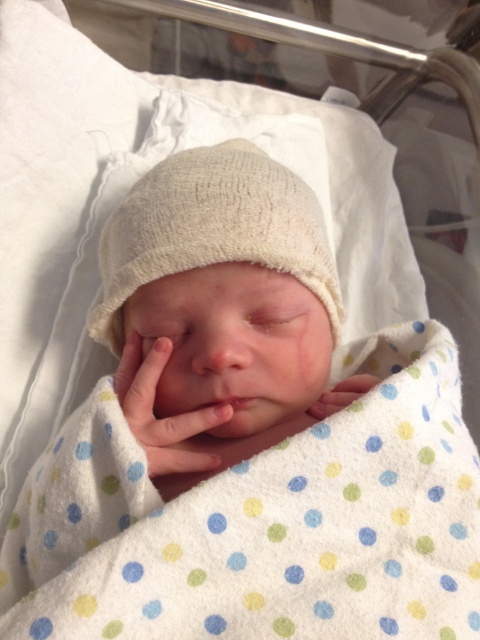
Question: Does soft white knit at center lie in front of smooth skin hand at center?

Choices:
 (A) no
 (B) yes

Answer: (B)

Question: Can you confirm if soft white knit at center is positioned above smooth skin hand at center?

Choices:
 (A) no
 (B) yes

Answer: (B)

Question: Does white knitted hat at center have a lesser width compared to smooth skin hand at center?

Choices:
 (A) yes
 (B) no

Answer: (B)

Question: Among these points, which one is farthest from the camera?

Choices:
 (A) (365, 378)
 (B) (164, 355)

Answer: (A)

Question: Which object is closer to the camera taking this photo?

Choices:
 (A) soft white knit at center
 (B) white knitted hat at center
 (C) smooth skin hand at center

Answer: (B)

Question: Which object appears farthest from the camera in this image?

Choices:
 (A) soft white knit at center
 (B) white knitted hat at center
 (C) smooth skin hand at center

Answer: (C)